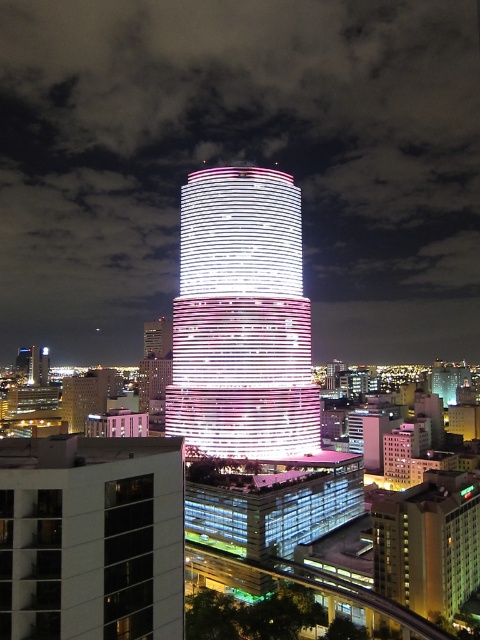
You are a drone operator planning to fly a drone between the white glossy tower at center and the glassy reflective building at lower left. The drone has a maximum flight distance of 50 meters. Can the drone safely fly between these two buildings without exceeding its range?

The white glossy tower at center and glassy reflective building at lower left are 49.97 meters apart from each other. Since the distance is just under the drone maximum flight distance of 50 meters, the drone can safely fly between them without exceeding its range.

You are an architect evaluating the city layout. You need to determine which of the two buildings, the white glossy tower at center or the glassy reflective building at lower left, would require more materials for a similar height. Based on their sizes in the image, which one would need more materials?

The white glossy tower at center has a larger size compared to the glassy reflective building at lower left, so it would require more materials for a similar height.

You are a photographer standing in the city square. You want to take a photo of the glassy reflective building at lower left without the white glossy tower at center blocking the view. Is it possible?

The glassy reflective building at lower left is behind the white glossy tower at center, so it is blocked by the tower and cannot be seen without moving to a different position where the tower is not in front.